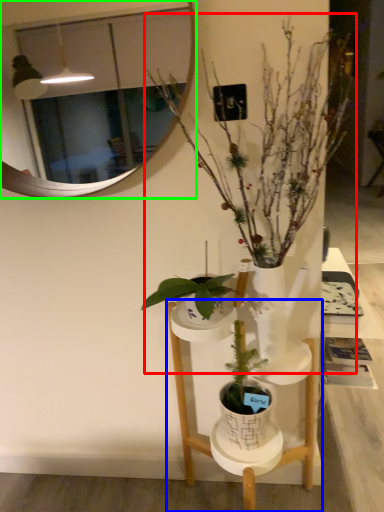
Question: Which is farther away from houseplant (highlighted by a red box)? furniture (highlighted by a blue box) or mirror (highlighted by a green box)?

Choices:
 (A) furniture
 (B) mirror

Answer: (A)